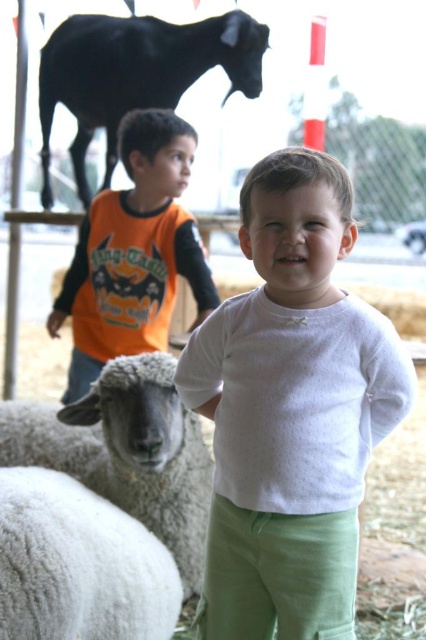
Consider the image. Can you confirm if white fluffy wool at lower left is shorter than white woolly sheep at lower left?

Correct, white fluffy wool at lower left is not as tall as white woolly sheep at lower left.

Between white fluffy wool at lower left and white woolly sheep at lower left, which one is positioned higher?

white woolly sheep at lower left is higher up.

Identify the location of white fluffy wool at lower left. (78, 564).

Does point (97, 285) come closer to viewer compared to point (49, 458)?

No, (97, 285) is behind (49, 458).

Does orange long-sleeved shirt at left appear on the left side of white woolly sheep at lower left?

No, orange long-sleeved shirt at left is not to the left of white woolly sheep at lower left.

Who is more distant from viewer, [207,276] or [166,452]?

Point [207,276]

Image resolution: width=426 pixels, height=640 pixels. I want to click on orange long-sleeved shirt at left, so click(134, 252).

Which is more to the left, white soft shirt at center or white woolly sheep at lower left?

white woolly sheep at lower left is more to the left.

Between white soft shirt at center and white woolly sheep at lower left, which one is positioned higher?

white soft shirt at center is higher up.

Where is `white soft shirt at center`? The image size is (426, 640). white soft shirt at center is located at coordinates (290, 410).

This screenshot has height=640, width=426. What are the coordinates of `white soft shirt at center` in the screenshot? It's located at (290, 410).